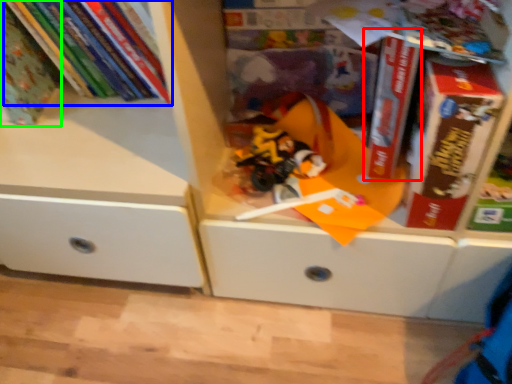
Question: Based on their relative distances, which object is nearer to paperback book (highlighted by a red box)? Choose from book (highlighted by a blue box) and book (highlighted by a green box).

Choices:
 (A) book
 (B) book

Answer: (A)